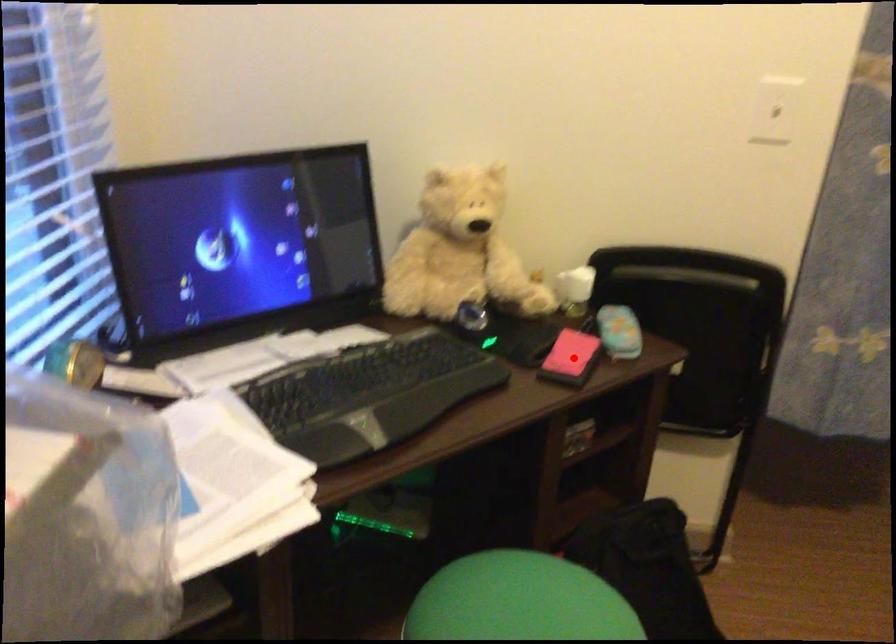
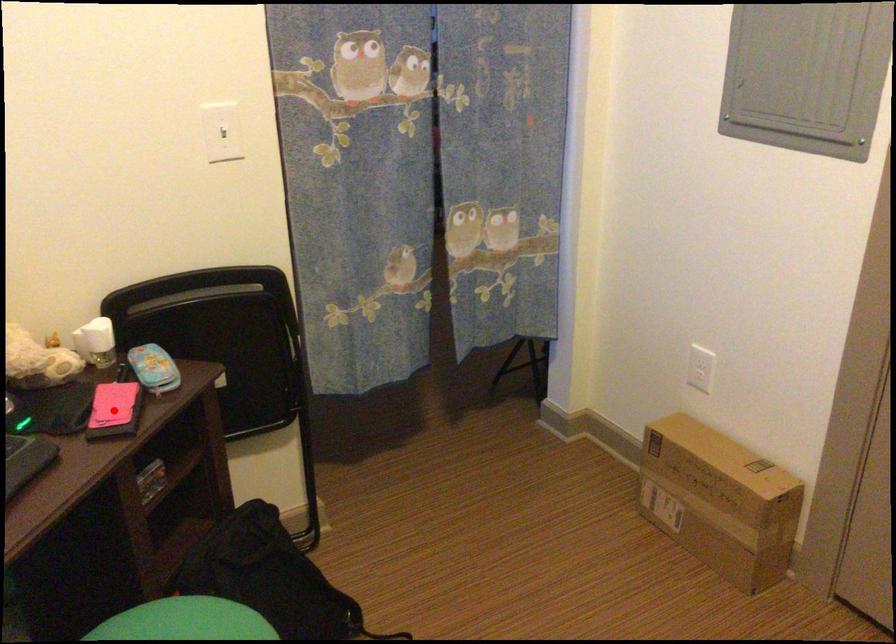
I am providing you with two images of the same scene from different viewpoints. A red point is marked on the first image and another point is marked on the second image. Does the point marked in image1 correspond to the same location as the one in image2?

Yes